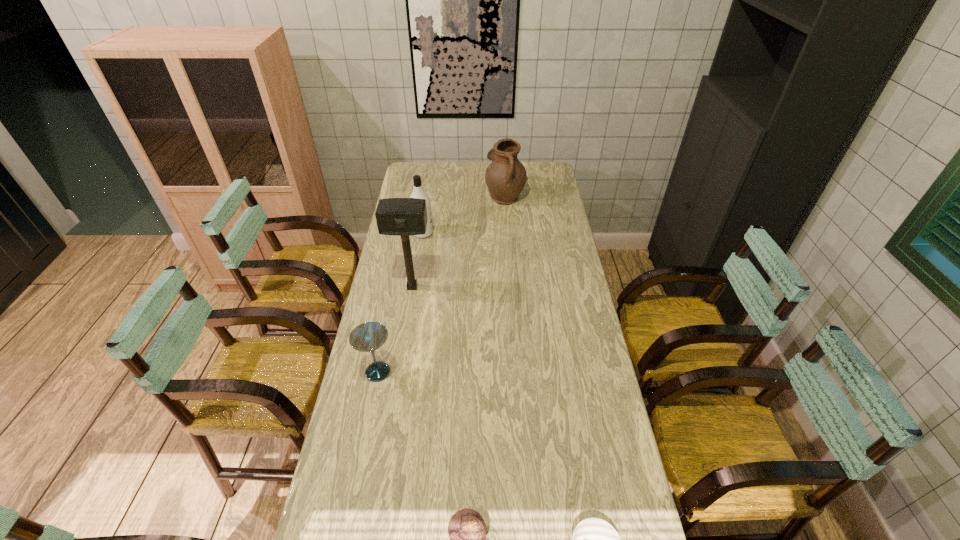
The height and width of the screenshot is (540, 960). I want to click on the third farthest object, so click(404, 217).

At what (x,y) coordinates should I click in order to perform the action: click on the tallest object. Please return your answer as a coordinate pair (x, y). Image resolution: width=960 pixels, height=540 pixels. Looking at the image, I should click on coord(404,217).

Locate an element on the screen. This screenshot has width=960, height=540. pitcher is located at coordinates (505, 177).

Find the location of a particular element. Image resolution: width=960 pixels, height=540 pixels. the second farthest object is located at coordinates (418, 192).

The image size is (960, 540). What are the coordinates of `the fourth tallest object` in the screenshot? It's located at coord(367,337).

The width and height of the screenshot is (960, 540). Identify the location of the fourth farthest object. (x=367, y=337).

Find the location of `vacant space located 0.250m on the right of the fourth nearest object`. vacant space located 0.250m on the right of the fourth nearest object is located at coordinates (496, 287).

You are a GUI agent. You are given a task and a screenshot of the screen. Output one action in this format:
    pyautogui.click(x=<x>, y=<y>)
    Task: Click on the free space located at the spout of the pitcher
    The width and height of the screenshot is (960, 540).
    Given the screenshot: What is the action you would take?
    pyautogui.click(x=470, y=195)

Image resolution: width=960 pixels, height=540 pixels. Find the location of `free space located at the spout of the pitcher`. free space located at the spout of the pitcher is located at coordinates (468, 195).

Find the location of a particular element. This screenshot has width=960, height=540. vacant space situated 0.140m at the spout of the pitcher is located at coordinates (457, 195).